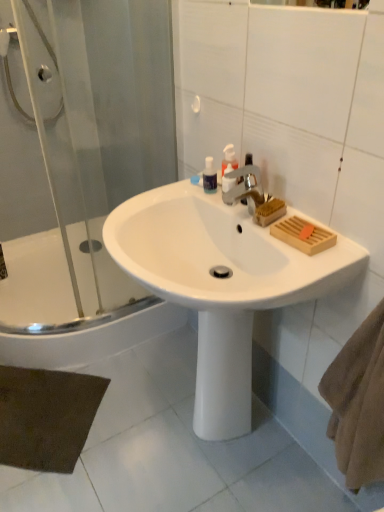
Identify the location of vacant space underneath transparent glass shower door at left (from a real-world perspective). The image size is (384, 512). (125, 313).